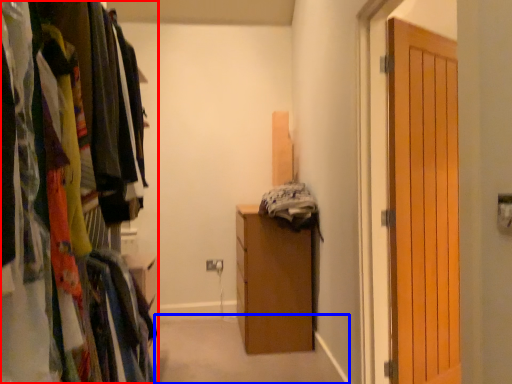
Question: Which object is closer to the camera taking this photo, cabinetry (highlighted by a red box) or path (highlighted by a blue box)?

Choices:
 (A) cabinetry
 (B) path

Answer: (A)